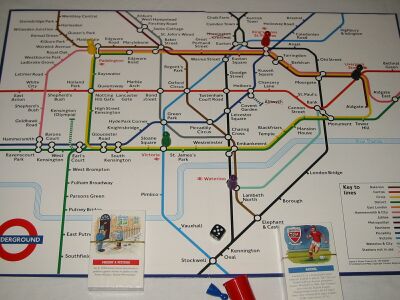
This screenshot has width=400, height=300. I want to click on board game cards, so click(112, 241), click(311, 248).